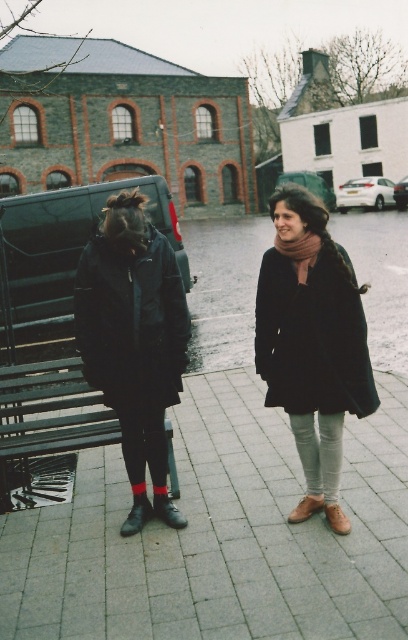
You are a photographer trying to capture both the brown leather boot at lower center and the brown suede boot at lower right in a single shot. The minimum distance between the two boots must be at least 6 inches for the photo to look balanced. Based on the scene, will the boots be positioned far enough apart?

The brown leather boot at lower center and brown suede boot at lower right are 5.59 inches apart, which is less than the required 6 inches. Therefore, the boots are not positioned far enough apart for the photo to look balanced.

You are standing in the courtyard and want to place a small potted plant between the gray concrete pavement at lower center and the black rubber boot at lower left. Based on their positions, which object should the plant be closer to?

The gray concrete pavement at lower center is to the right of the black rubber boot at lower left, so the plant should be placed closer to the black rubber boot at lower left to be between them.